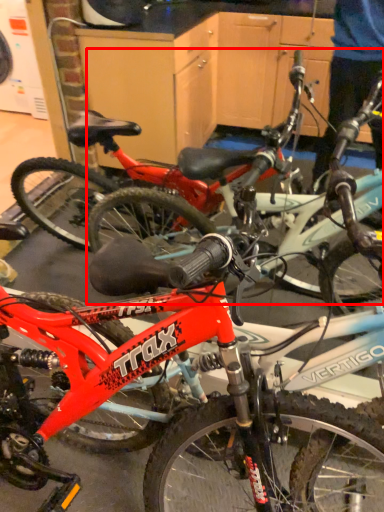
Question: From the image's perspective, what is the correct spatial relationship of bicycle (annotated by the red box) in relation to bicycle?

Choices:
 (A) above
 (B) below

Answer: (A)